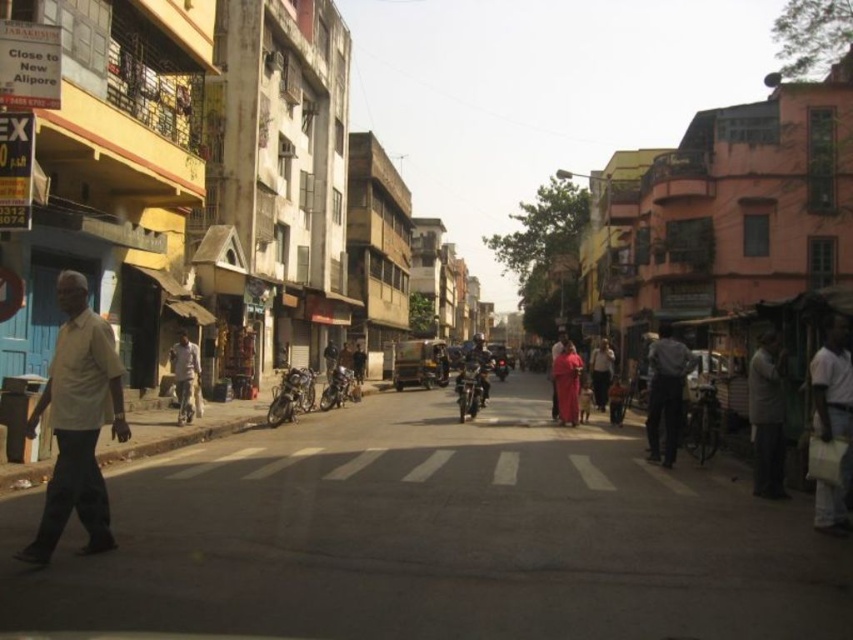
Question: Which object is closer to the camera taking this photo?

Choices:
 (A) dark gray fabric pants at center
 (B) light brown fabric shirt at left
 (C) shiny metallic motorcycle at center

Answer: (A)

Question: Which object is the closest to the shiny metallic motorcycle at center?

Choices:
 (A) dark gray fabric pants at center
 (B) white matte shirt at right
 (C) light beige shirt at left

Answer: (A)

Question: Can you confirm if light beige shirt at left is positioned to the left of white matte shirt at right?

Choices:
 (A) no
 (B) yes

Answer: (B)

Question: Is dark gray fabric pants at center to the left of light brown fabric shirt at left from the viewer's perspective?

Choices:
 (A) no
 (B) yes

Answer: (A)

Question: Among these points, which one is farthest from the camera?

Choices:
 (A) (488, 392)
 (B) (769, 435)
 (C) (177, 417)
 (D) (51, 403)

Answer: (A)

Question: Is shiny metallic motorcycle at center positioned in front of matte black motorcycle at center?

Choices:
 (A) no
 (B) yes

Answer: (B)